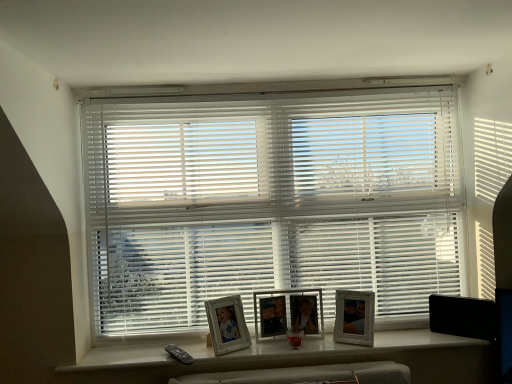
Locate an element on the screen. This screenshot has height=384, width=512. vacant area on top of white plastic frames at center (from a real-world perspective) is located at coordinates (296, 341).